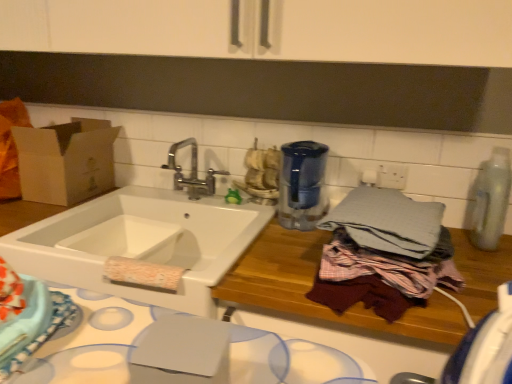
Question: Considering the positions of gray cotton bath towel at right and blue fabric cloth at lower left in the image, is gray cotton bath towel at right taller or shorter than blue fabric cloth at lower left?

Choices:
 (A) tall
 (B) short

Answer: (A)

Question: Based on their positions, is gray cotton bath towel at right located to the left or right of blue fabric cloth at lower left?

Choices:
 (A) right
 (B) left

Answer: (A)

Question: Which object is positioned farthest from the blue fabric cloth at lower left?

Choices:
 (A) blue glass water filter at center, acting as the second appliance starting from the right
 (B) gray cotton bath towel at right
 (C) chrome metallic faucet at upper center
 (D) clear plastic bottle at right, marked as the 2th appliance in a left-to-right arrangement
 (E) brown cardboard box at left

Answer: (D)

Question: Which object is positioned closest to the blue glass water filter at center, the 1th appliance when ordered from left to right?

Choices:
 (A) wooden cutting board at center
 (B) white ceramic sink at center
 (C) brown cardboard box at left
 (D) gray cotton bath towel at right
 (E) blue fabric cloth at lower left

Answer: (B)